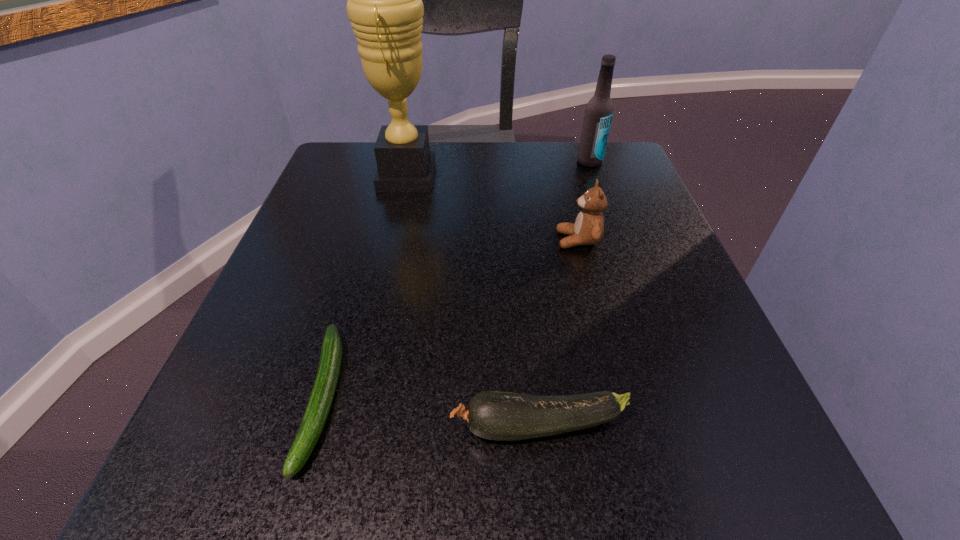
Image resolution: width=960 pixels, height=540 pixels. I want to click on vacant area situated on the side of the rightmost object with the label, so click(x=634, y=286).

Locate an element on the screen. vacant area situated 0.140m on the front-facing side of the teddy bear is located at coordinates (480, 240).

You are a GUI agent. You are given a task and a screenshot of the screen. Output one action in this format:
    pyautogui.click(x=<x>, y=<y>)
    Task: Click on the vacant space located on the front-facing side of the teddy bear
    Image resolution: width=960 pixels, height=540 pixels.
    Given the screenshot: What is the action you would take?
    pyautogui.click(x=374, y=240)

Locate an element on the screen. This screenshot has height=540, width=960. vacant area situated on the front-facing side of the teddy bear is located at coordinates 380,240.

The width and height of the screenshot is (960, 540). Identify the location of vacant area situated at the blossom end of the second shortest object. (289, 426).

Where is `vacant region located 0.260m at the blossom end of the second shortest object`? vacant region located 0.260m at the blossom end of the second shortest object is located at coordinates point(240,426).

Locate an element on the screen. free space located at the blossom end of the second shortest object is located at coordinates (338, 426).

The width and height of the screenshot is (960, 540). What are the coordinates of `trophy cup at the far edge` in the screenshot? It's located at (385, 7).

Where is `beer bottle that is at the far edge`? beer bottle that is at the far edge is located at coordinates (599, 110).

In order to click on trophy cup situated at the left edge in this screenshot , I will do `click(385, 7)`.